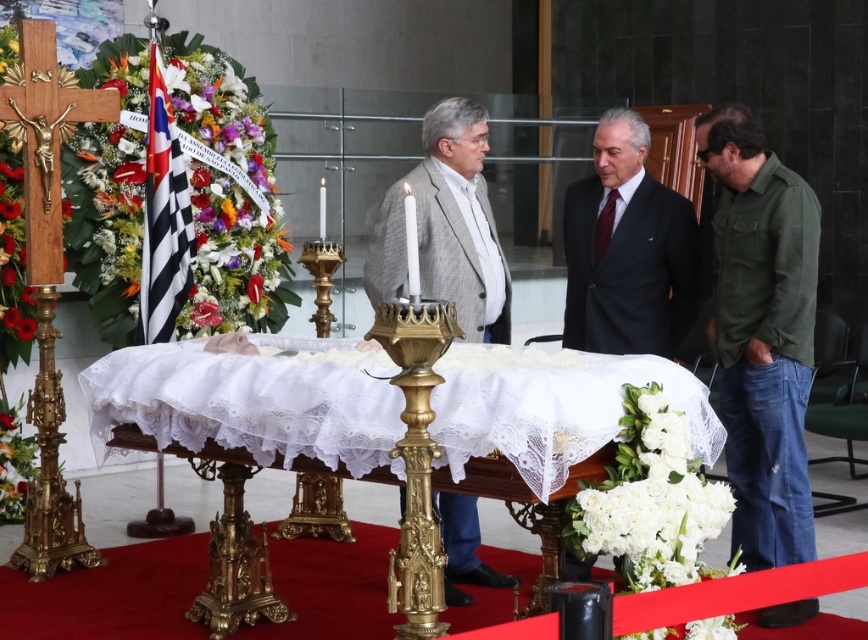
Who is more distant from viewer, (464, 262) or (635, 136)?

Positioned behind is point (635, 136).

Between point (467, 570) and point (682, 320), which one is positioned behind?

Point (682, 320)

The image size is (868, 640). Identify the location of gray wool jacket at center. (446, 227).

Does green denim jacket at lower right appear on the left side of black suit at center?

No, green denim jacket at lower right is not to the left of black suit at center.

Between point (787, 609) and point (609, 244), which one is positioned behind?

Point (609, 244)

Is point (797, 394) farther from viewer compared to point (576, 243)?

No.

Where is `green denim jacket at lower right`? This screenshot has height=640, width=868. green denim jacket at lower right is located at coordinates (761, 333).

Who is lower down, green denim jacket at lower right or gray wool jacket at center?

green denim jacket at lower right is below.

Between point (781, 381) and point (452, 292), which one is positioned behind?

Point (452, 292)

What are the coordinates of `green denim jacket at lower right` in the screenshot? It's located at (761, 333).

This screenshot has width=868, height=640. Find the location of `green denim jacket at lower right`. green denim jacket at lower right is located at coordinates (761, 333).